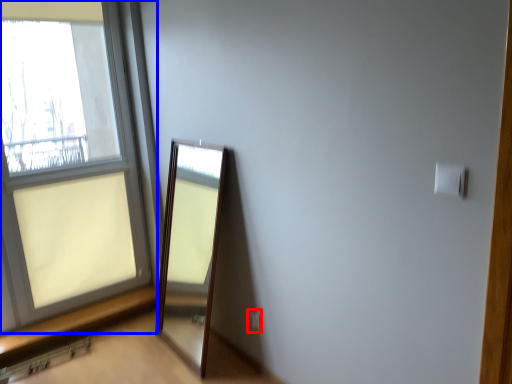
Question: Which object appears closest to the camera in this image, electric outlet (highlighted by a red box) or window (highlighted by a blue box)?

Choices:
 (A) electric outlet
 (B) window

Answer: (B)